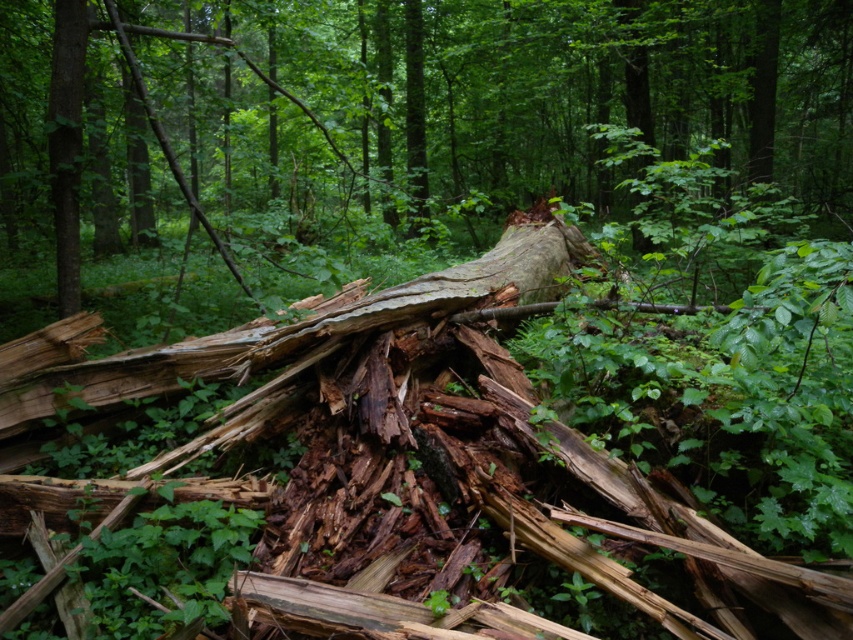
You are a park ranger who needs to place a 10 meter long safety barrier between the rough bark log at center and the smooth brown tree trunk at left. Can you fit the barrier between them?

The distance between the rough bark log at center and the smooth brown tree trunk at left is 9.99 meters. Since the barrier is 10 meters long, it will not fit as the space is slightly shorter by 0.01 meters.

You are a hiker who has stumbled upon this forest scene. You need to cross from the left side to the right side of the forest. The smooth brown tree trunk at left is blocking your path. Can you go around it using the rough bark log at center?

The rough bark log at center is positioned on the right side of the smooth brown tree trunk at left. Therefore, you can go around the smooth brown tree trunk at left by moving towards the rough bark log at center to reach the right side of the forest.